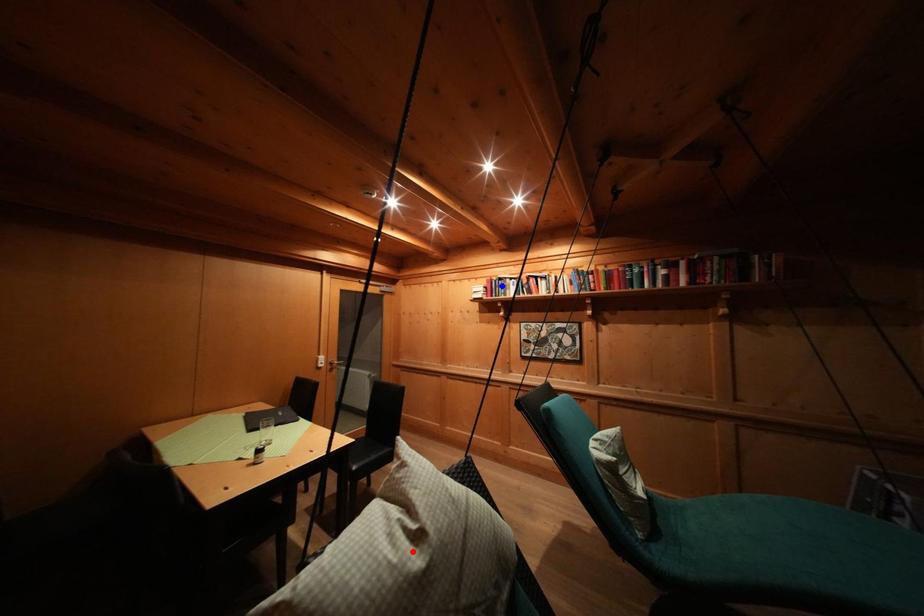
Question: Which of the two points in the image is closer to the camera?

Choices:
 (A) Blue point is closer.
 (B) Red point is closer.

Answer: (B)